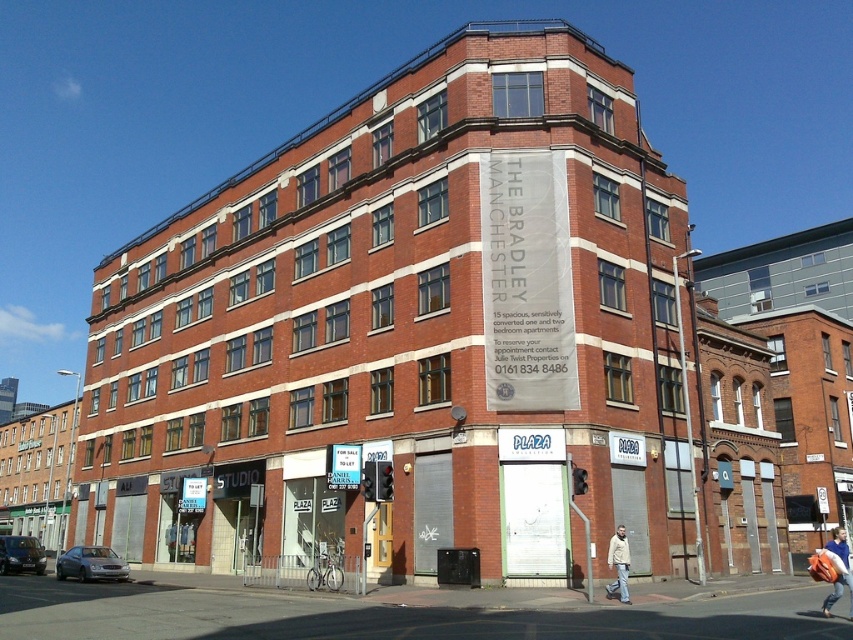
You are a customer looking to purchase a jacket. You see a blue denim jacket at lower right and a beige fabric jacket at lower right. Which jacket is located lower in the image?

The blue denim jacket at lower right is positioned under the beige fabric jacket at lower right, so it is located lower in the image.

You are a delivery person standing at the entrance of the building. You need to place a package between the blue denim jacket at lower right and the beige fabric jacket at lower right. The package is 2 meters long. Can you fit it between them without moving the jackets?

The distance between the blue denim jacket at lower right and beige fabric jacket at lower right is 7.57 meters, so yes, the package can be placed between them as there is sufficient space.

Consider the image. You are standing at the corner of the street looking at the multi story brick building. You see a blue denim jacket at lower right. Is the jacket closer to the building or the street corner?

The blue denim jacket at lower right is located at point [838,570], which places it closer to the building than the street corner.